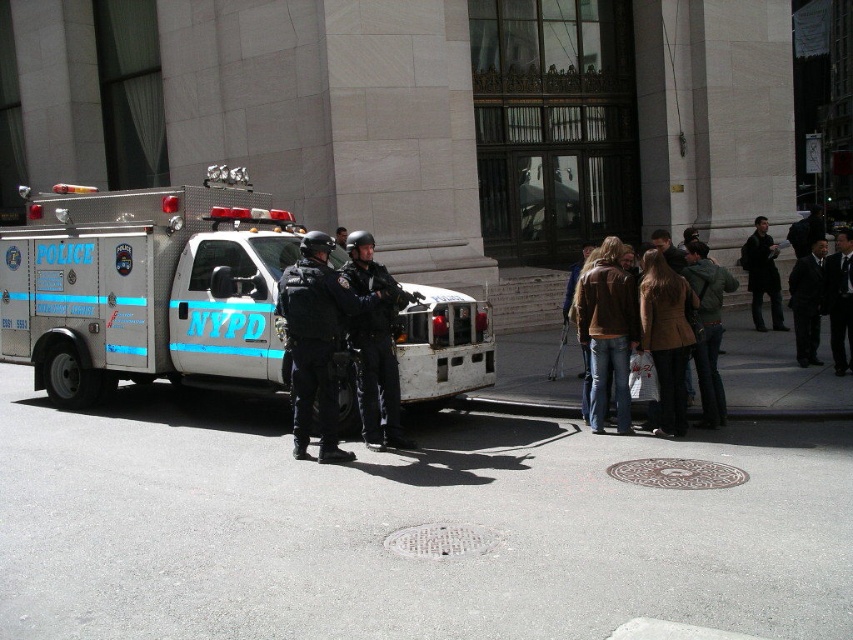
You are a tailor who needs to determine which jacket to alter first. The green fabric jacket at center and the dark brown leather jacket at right are both in need of adjustments. Which jacket requires a wider alteration to fit a larger frame?

The dark brown leather jacket at right requires a wider alteration to fit a larger frame because its width is greater than the green fabric jacket at center.

You are a pedestrian who needs to cross the street quickly. The brown suede jacket at lower right and black smooth suit at right are in your path. Can you estimate whether the space between them is wide enough for you to pass through?

The distance between the brown suede jacket at lower right and black smooth suit at right is 3.97 meters, which is more than enough for a pedestrian to pass through safely.

You are a pedestrian standing at the point labeled point (804, 284). You want to walk to the point labeled point (601, 324). Which direction should you walk relative to the police truck?

You should walk forward relative to the police truck because point (601, 324) is in front of point (804, 284).